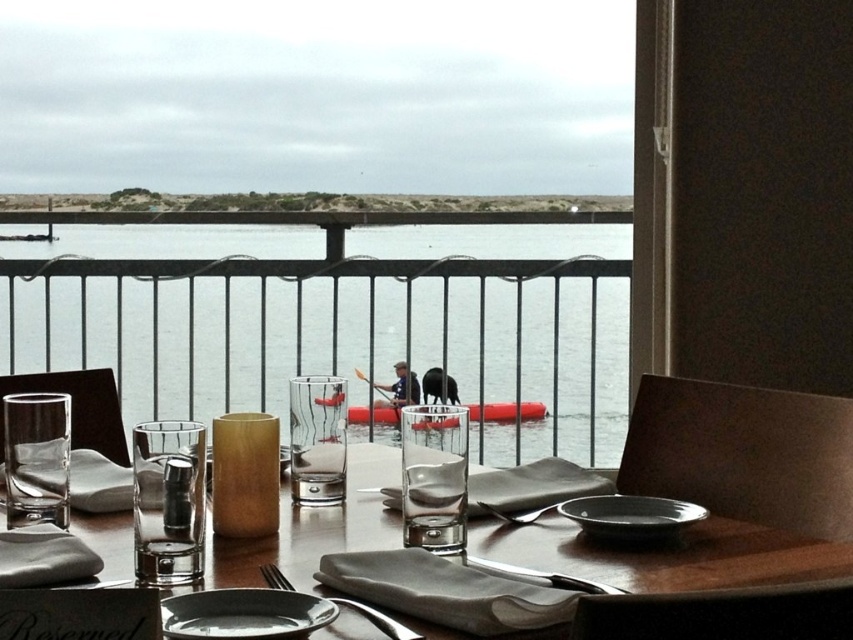
You are standing on the balcony and want to reach both the point at coordinates point [527,298] and point [402,625]. Which point will you reach first if you move towards them?

You will reach point [402,625] first because it is closer to you than point [527,298], which is further away.